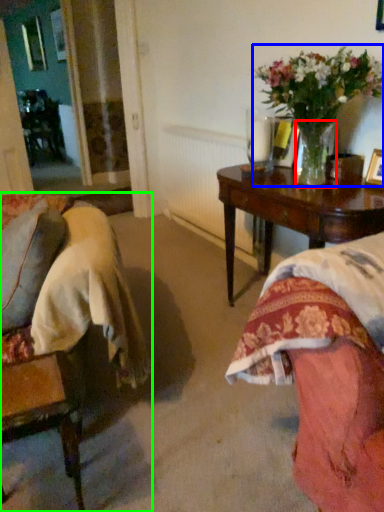
Question: Which object is the closest to the vase (highlighted by a red box)? Choose among these: houseplant (highlighted by a blue box) or chair (highlighted by a green box).

Choices:
 (A) houseplant
 (B) chair

Answer: (A)